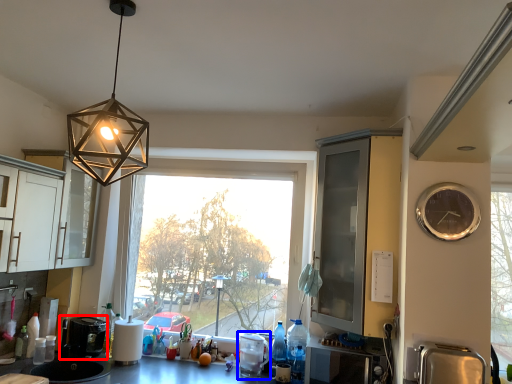
Question: Which object is further to the camera taking this photo, coffee machine (highlighted by a red box) or appliance (highlighted by a blue box)?

Choices:
 (A) coffee machine
 (B) appliance

Answer: (A)